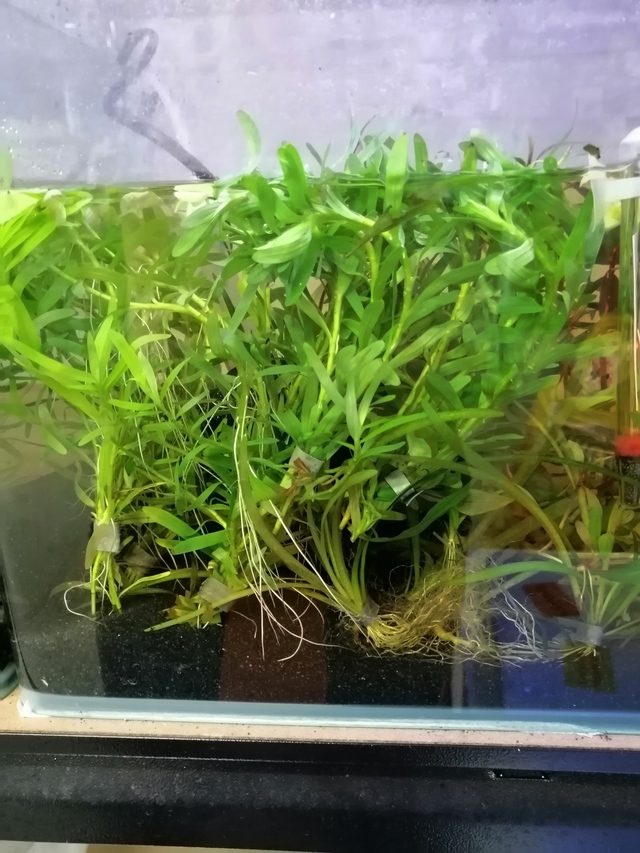
The width and height of the screenshot is (640, 853). Identify the location of grassy plant. (105, 456).